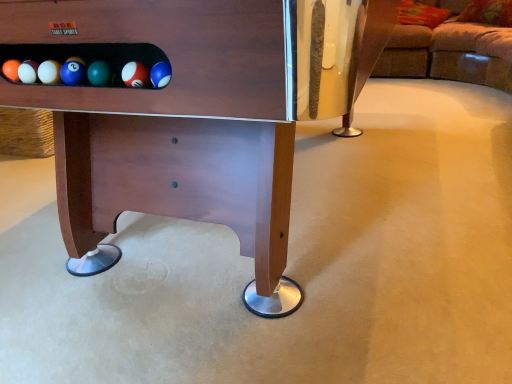
Question: From a real-world perspective, is brown fabric couch at upper right under wooden pool table at center?

Choices:
 (A) yes
 (B) no

Answer: (A)

Question: Considering the relative sizes of brown fabric couch at upper right and wooden pool table at center in the image provided, is brown fabric couch at upper right wider than wooden pool table at center?

Choices:
 (A) no
 (B) yes

Answer: (B)

Question: Is brown fabric couch at upper right outside of wooden pool table at center?

Choices:
 (A) yes
 (B) no

Answer: (A)

Question: Could wooden pool table at center be considered to be inside brown fabric couch at upper right?

Choices:
 (A) no
 (B) yes

Answer: (A)

Question: Does brown fabric couch at upper right appear on the right side of wooden pool table at center?

Choices:
 (A) yes
 (B) no

Answer: (A)

Question: Is brown fabric couch at upper right to the left of wooden pool table at center from the viewer's perspective?

Choices:
 (A) no
 (B) yes

Answer: (A)

Question: Are wooden pool table at center and brown fabric couch at upper right beside each other?

Choices:
 (A) yes
 (B) no

Answer: (B)

Question: Is wooden pool table at center thinner than brown fabric couch at upper right?

Choices:
 (A) no
 (B) yes

Answer: (B)

Question: Is wooden pool table at center shorter than brown fabric couch at upper right?

Choices:
 (A) no
 (B) yes

Answer: (A)

Question: Is wooden pool table at center not near brown fabric couch at upper right?

Choices:
 (A) no
 (B) yes

Answer: (B)

Question: Is wooden pool table at center not within brown fabric couch at upper right?

Choices:
 (A) no
 (B) yes

Answer: (B)

Question: Does wooden pool table at center appear on the left side of brown fabric couch at upper right?

Choices:
 (A) yes
 (B) no

Answer: (A)

Question: Would you say wooden pool table at center is inside or outside brown fabric couch at upper right?

Choices:
 (A) inside
 (B) outside

Answer: (B)